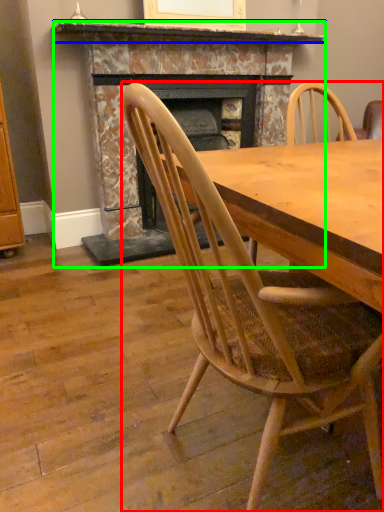
Question: Which is farther away from chair (highlighted by a red box)? mantle (highlighted by a blue box) or fireplace (highlighted by a green box)?

Choices:
 (A) mantle
 (B) fireplace

Answer: (A)